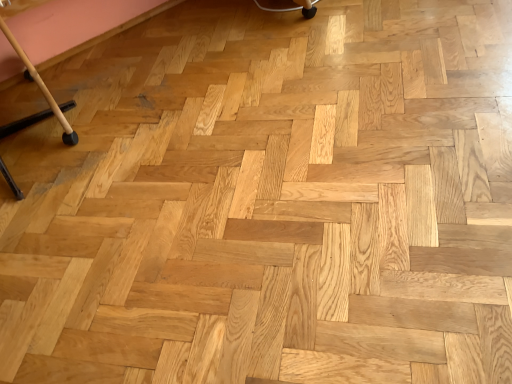
Where is `vacant space to the right of wooden cane at left`? This screenshot has height=384, width=512. vacant space to the right of wooden cane at left is located at coordinates (178, 131).